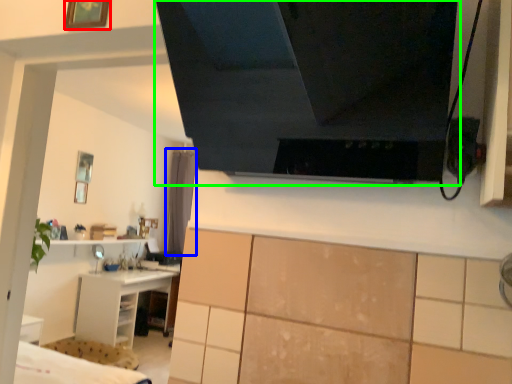
Question: Which object is the farthest from picture frame (highlighted by a red box)? Choose among these: curtain (highlighted by a blue box) or exhaust hood (highlighted by a green box).

Choices:
 (A) curtain
 (B) exhaust hood

Answer: (A)